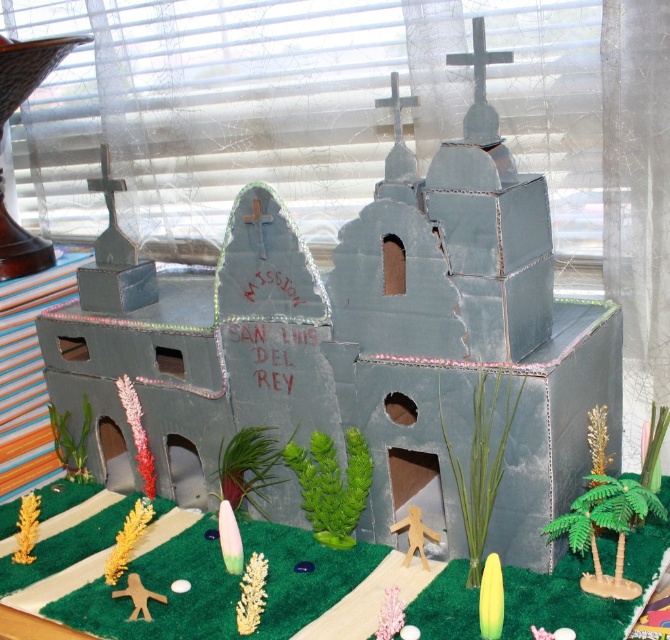
You are a visitor standing in front of the model mission. You see a gold textured plant at lower center and a green matte surfboard at lower center. Which object is positioned to the left when viewed from your perspective?

The gold textured plant at lower center is to the left of the green matte surfboard at lower center.